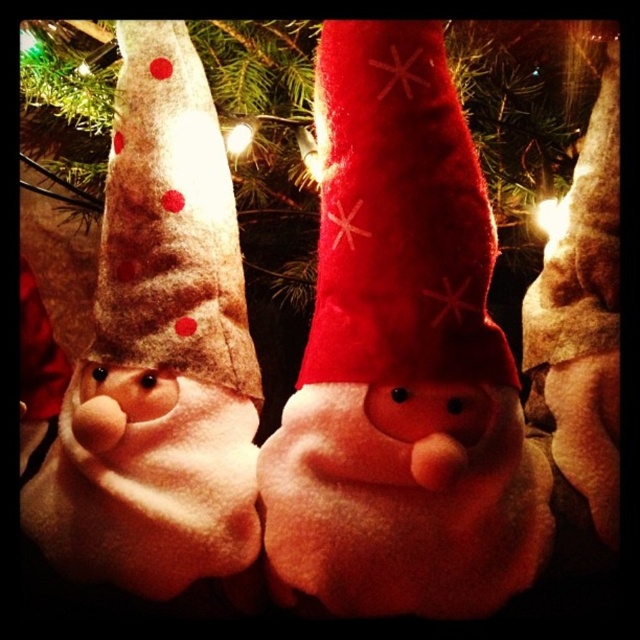
You are decorating a Christmas tree and have the beige felt gnome at left and the beige felt hat with red polka dots at left. Which item takes up more horizontal space on the tree?

The beige felt gnome at left is wider than the beige felt hat with red polka dots at left, so it takes up more horizontal space on the tree.

You are looking at the three plush gnomes hanging on the Christmas tree. There are two points marked in the image. One is at coordinates point (426, 289) and the other is at point (525, 534). Which of these two points is nearer to you?

Point (426, 289) is closer to the viewer than point (525, 534).